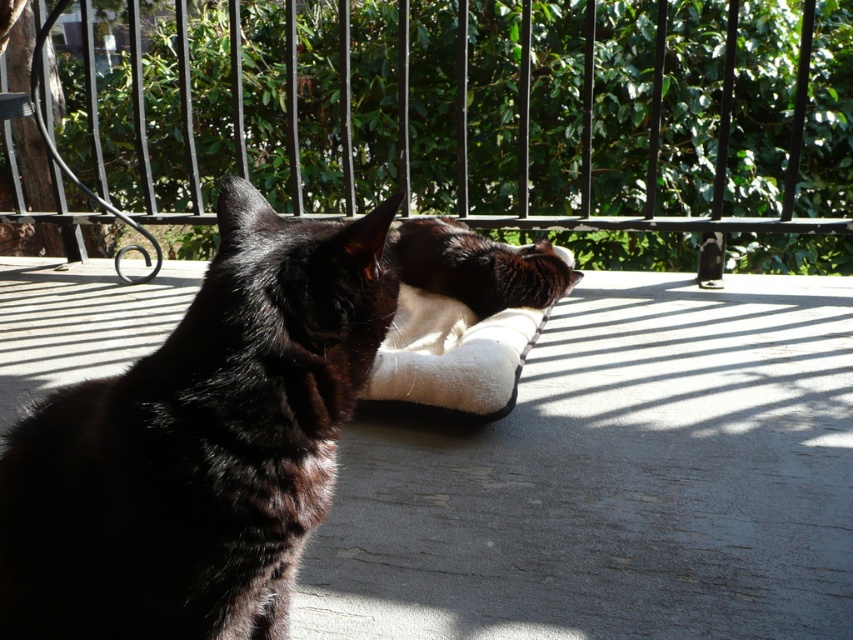
Question: Which of the following is the farthest from the observer?

Choices:
 (A) (265, 561)
 (B) (450, 289)
 (C) (834, 221)

Answer: (C)

Question: Can you confirm if black metal fence at upper center is positioned to the right of black fur cat at center?

Choices:
 (A) no
 (B) yes

Answer: (A)

Question: Is black metal fence at upper center smaller than black soft cushion at center?

Choices:
 (A) yes
 (B) no

Answer: (B)

Question: Among these points, which one is farthest from the camera?

Choices:
 (A) (424, 276)
 (B) (25, 218)

Answer: (B)

Question: Where is black metal fence at upper center located in relation to black soft cushion at center in the image?

Choices:
 (A) below
 (B) above

Answer: (B)

Question: Which object is farther from the camera taking this photo?

Choices:
 (A) black fur cat at center
 (B) black metal fence at upper center

Answer: (B)